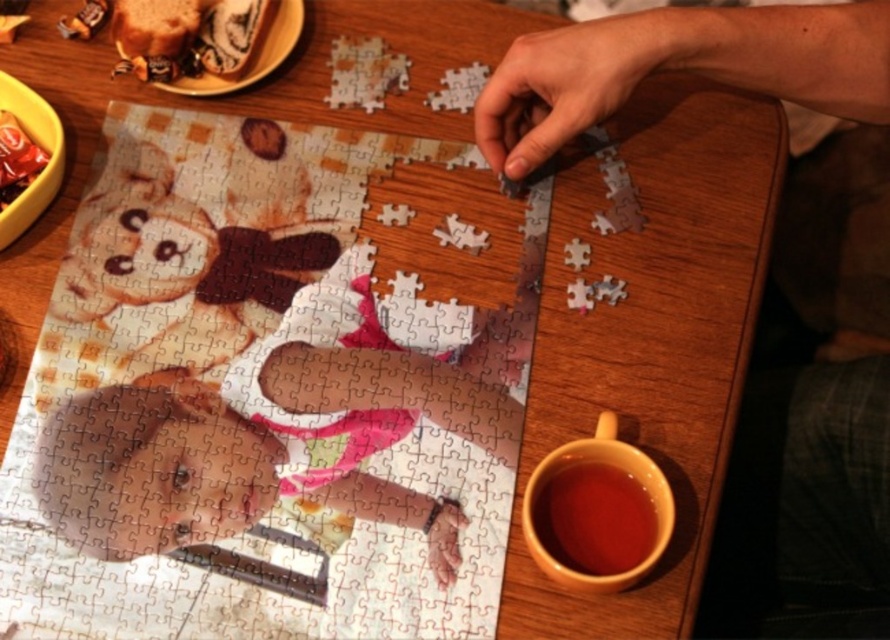
Question: Is shiny chocolate bar at lower left to the left of matte plastic hand at center from the viewer's perspective?

Choices:
 (A) yes
 (B) no

Answer: (A)

Question: Which object is closer to the camera taking this photo?

Choices:
 (A) smooth plastic baby at center
 (B) matte plastic hand at center
 (C) smooth skin hand at upper right
 (D) shiny chocolate bar at lower left

Answer: (C)

Question: Which object is positioned closest to the matte ceramic mug at lower right?

Choices:
 (A) matte plastic hand at center
 (B) smooth wooden table at center
 (C) smooth skin hand at upper right

Answer: (A)

Question: Can you confirm if smooth skin hand at upper right is positioned below shiny chocolate bar at lower left?

Choices:
 (A) yes
 (B) no

Answer: (B)

Question: Which point is farther from the camera taking this photo?

Choices:
 (A) (578, 506)
 (B) (14, 150)
 (C) (437, 547)
 (D) (534, 90)

Answer: (B)

Question: Is smooth plastic baby at center thinner than matte ceramic mug at lower right?

Choices:
 (A) no
 (B) yes

Answer: (A)